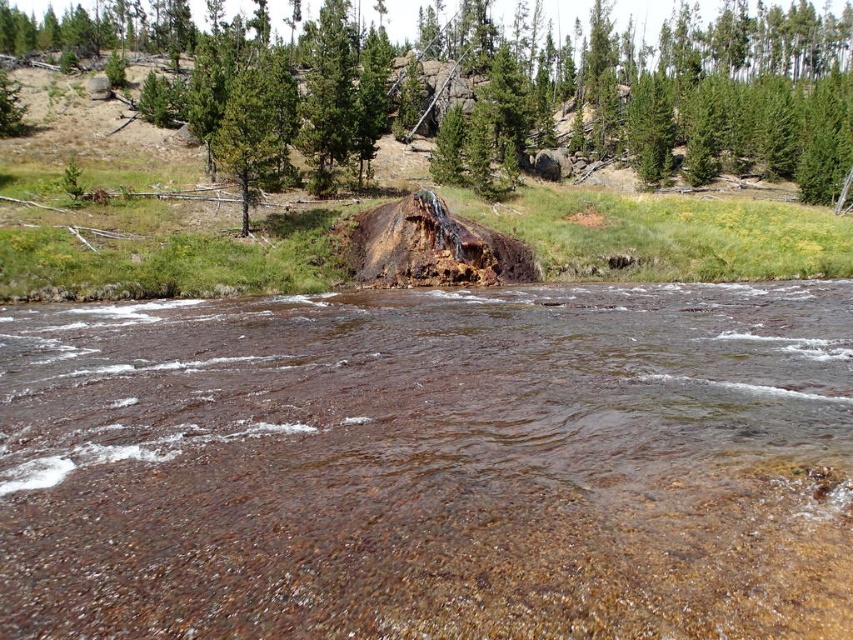
You are a hiker standing at the edge of the river, and you see the green matte tree at center and the green rough bark tree trunk at center. Which tree is closer to you?

The green rough bark tree trunk at center is closer to you because it is only 119.10 meters away from the green matte tree at center, which is farther away.

You are standing at the edge of the river and see the green matte tree at center and the green rough bark tree at upper center. Which tree is positioned more to the left?

The green rough bark tree at upper center is positioned more to the left than the green matte tree at center.